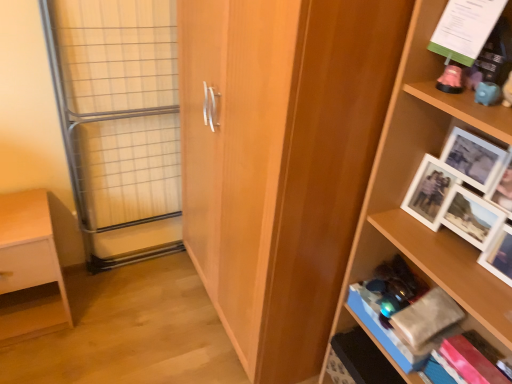
Where is `vacant point to the right of clear glass door at left`? This screenshot has height=384, width=512. vacant point to the right of clear glass door at left is located at coordinates (176, 281).